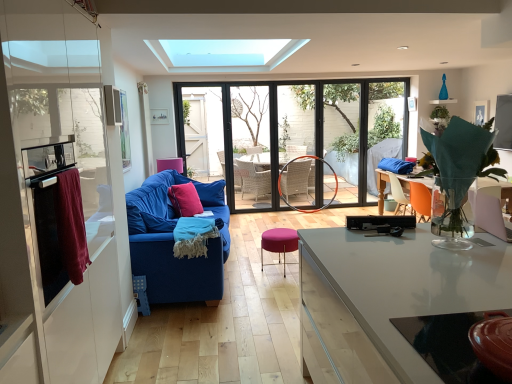
Question: From the image's perspective, is pink fabric armchair at center under pink velvet pillow at center?

Choices:
 (A) yes
 (B) no

Answer: (B)

Question: Does pink fabric armchair at center have a greater height compared to pink velvet pillow at center?

Choices:
 (A) no
 (B) yes

Answer: (A)

Question: Considering the relative sizes of pink fabric armchair at center and pink velvet pillow at center in the image provided, is pink fabric armchair at center smaller than pink velvet pillow at center?

Choices:
 (A) yes
 (B) no

Answer: (A)

Question: Is pink fabric armchair at center outside pink velvet pillow at center?

Choices:
 (A) no
 (B) yes

Answer: (B)

Question: Considering the relative sizes of pink fabric armchair at center and pink velvet pillow at center in the image provided, is pink fabric armchair at center wider than pink velvet pillow at center?

Choices:
 (A) yes
 (B) no

Answer: (A)

Question: From a real-world perspective, does pink fabric armchair at center stand above pink velvet pillow at center?

Choices:
 (A) yes
 (B) no

Answer: (A)

Question: Does pink fabric armchair at center come in front of purple fabric stool at center?

Choices:
 (A) yes
 (B) no

Answer: (B)

Question: Considering the relative positions of pink fabric armchair at center and purple fabric stool at center in the image provided, is pink fabric armchair at center behind purple fabric stool at center?

Choices:
 (A) yes
 (B) no

Answer: (A)

Question: Considering the relative sizes of pink fabric armchair at center and purple fabric stool at center in the image provided, is pink fabric armchair at center thinner than purple fabric stool at center?

Choices:
 (A) yes
 (B) no

Answer: (A)

Question: Is pink fabric armchair at center turned away from purple fabric stool at center?

Choices:
 (A) yes
 (B) no

Answer: (B)

Question: From a real-world perspective, is pink fabric armchair at center on purple fabric stool at center?

Choices:
 (A) yes
 (B) no

Answer: (A)

Question: Is pink fabric armchair at center positioned beyond the bounds of purple fabric stool at center?

Choices:
 (A) no
 (B) yes

Answer: (B)

Question: Does purple fabric stool at center have a smaller size compared to pink velvet throw pillow at center?

Choices:
 (A) no
 (B) yes

Answer: (A)